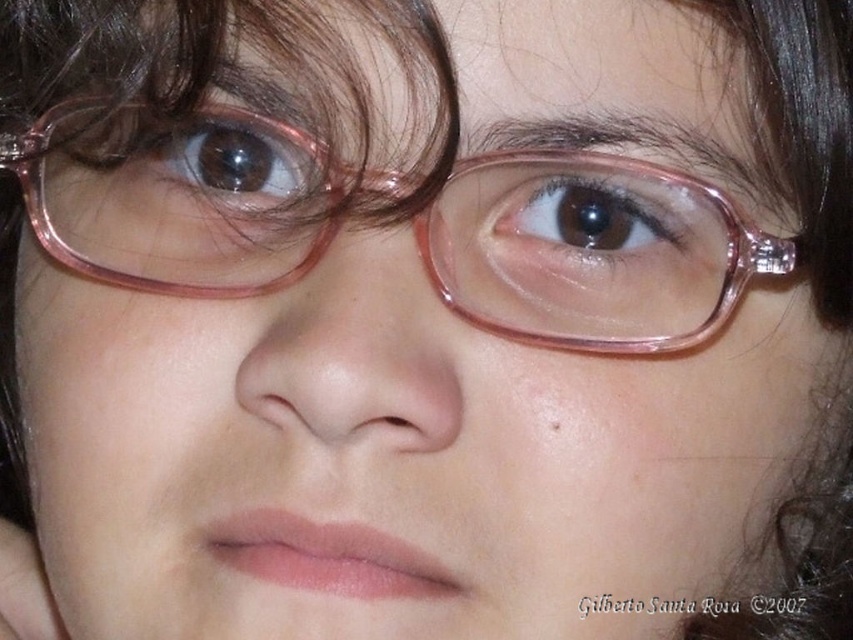
How distant is brown glossy eye at center from brownsmootheye at upper center?

brown glossy eye at center and brownsmootheye at upper center are 4.19 inches apart.

Which is behind, point (592, 227) or point (170, 180)?

Positioned behind is point (170, 180).

Is point (531, 236) closer to viewer compared to point (219, 150)?

That is True.

Where is `brown glossy eye at center`? brown glossy eye at center is located at coordinates (601, 214).

Can you confirm if transparent plastic glasses at center is taller than brownsmootheye at upper center?

Indeed, transparent plastic glasses at center has a greater height compared to brownsmootheye at upper center.

Which is in front, point (502, 230) or point (218, 118)?

Point (502, 230) is in front.

The height and width of the screenshot is (640, 853). I want to click on transparent plastic glasses at center, so click(x=590, y=250).

Is point (96, 157) in front of point (619, 259)?

No, (96, 157) is behind (619, 259).

Image resolution: width=853 pixels, height=640 pixels. Find the location of `transparent plastic glasses at center`. transparent plastic glasses at center is located at coordinates [x=590, y=250].

Which is behind, point (662, 177) or point (550, 209)?

The point (550, 209) is more distant.

Where is `transparent plastic glasses at center`? The image size is (853, 640). transparent plastic glasses at center is located at coordinates (590, 250).